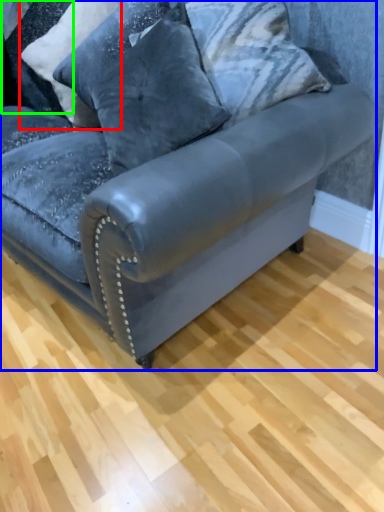
Question: Based on their relative distances, which object is nearer to pillow (highlighted by a red box)? Choose from studio couch (highlighted by a blue box) and pillow (highlighted by a green box).

Choices:
 (A) studio couch
 (B) pillow

Answer: (B)